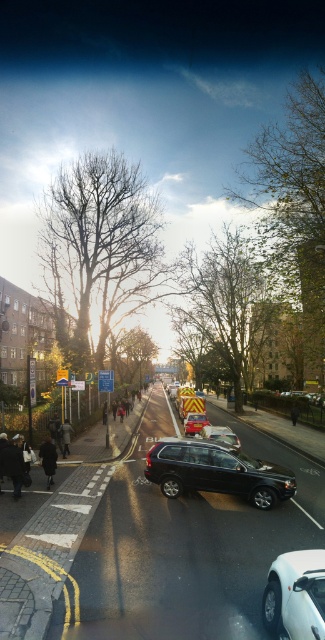
Is white glossy car at lower right above metallic silver suv at center?

Correct, white glossy car at lower right is located above metallic silver suv at center.

Is white glossy car at lower right thinner than metallic silver suv at center?

Yes, white glossy car at lower right is thinner than metallic silver suv at center.

Is point (316, 579) closer to camera compared to point (208, 420)?

That is True.

Find the location of a particular element. This screenshot has width=325, height=640. white glossy car at lower right is located at coordinates (296, 595).

Who is positioned more to the right, shiny black suv at center or metallic silver suv at center?

metallic silver suv at center is more to the right.

Can you confirm if shiny black suv at center is thinner than metallic silver suv at center?

In fact, shiny black suv at center might be wider than metallic silver suv at center.

This screenshot has width=325, height=640. What are the coordinates of `shiny black suv at center` in the screenshot? It's located at (216, 472).

I want to click on shiny black suv at center, so click(216, 472).

Is point (224, 458) closer to camera compared to point (313, 573)?

No, it is not.

Is point (157, 456) in front of point (301, 630)?

No.

At what (x,y) coordinates should I click in order to perform the action: click on shiny black suv at center. Please return your answer as a coordinate pair (x, y). The image size is (325, 640). Looking at the image, I should click on (216, 472).